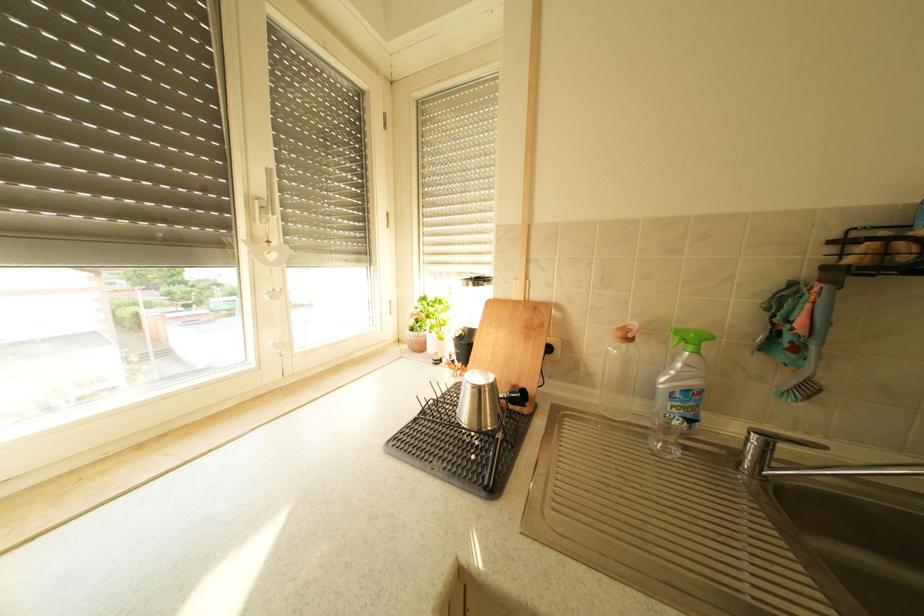
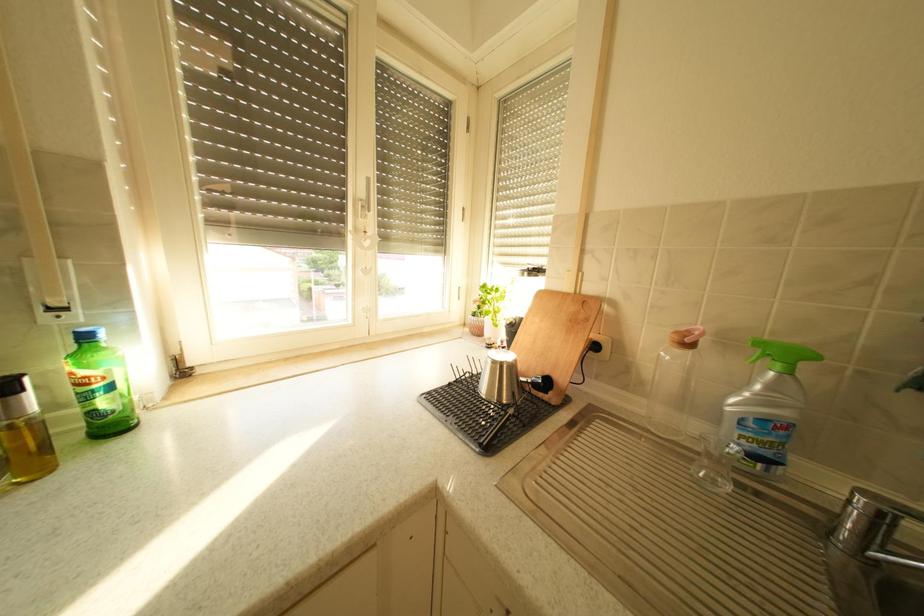
Question: The first image is from the beginning of the video and the second image is from the end. How did the camera likely rotate when shooting the video?

Choices:
 (A) Left
 (B) Right
 (C) Up
 (D) Down

Answer: (A)